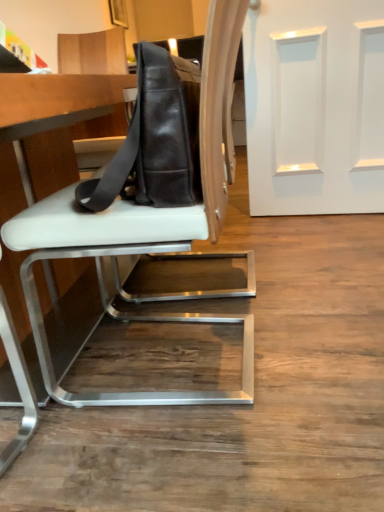
You are a GUI agent. You are given a task and a screenshot of the screen. Output one action in this format:
    pyautogui.click(x=<x>, y=<y>)
    Task: Click on the free space between white smooth door at upper right and white leather chair at center
    
    Given the screenshot: What is the action you would take?
    pyautogui.click(x=289, y=263)